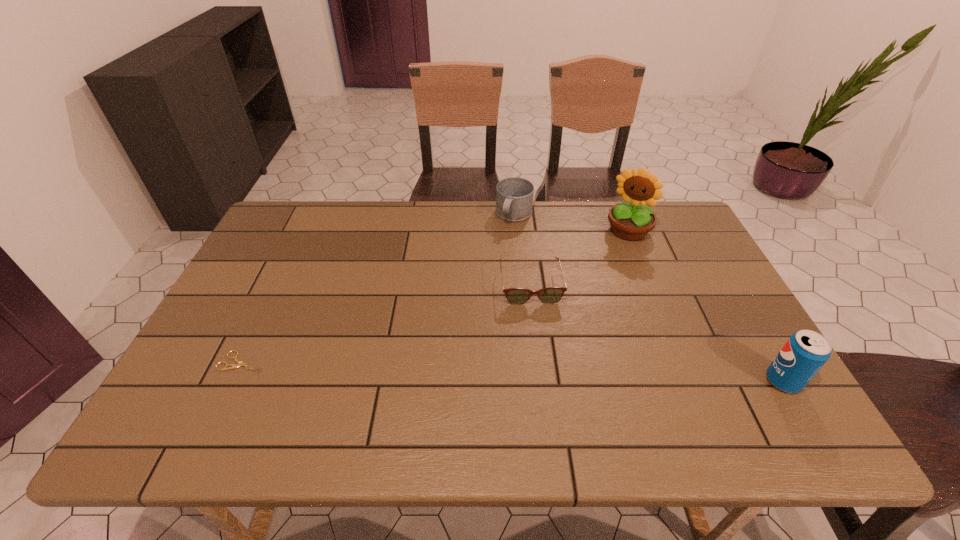
The height and width of the screenshot is (540, 960). Identify the location of vacant region at the far edge of the desktop. click(332, 222).

Locate an element on the screen. blank space at the near edge of the desktop is located at coordinates (486, 382).

Where is `vacant space at the left edge of the desktop`? This screenshot has height=540, width=960. vacant space at the left edge of the desktop is located at coordinates (253, 252).

At what (x,y) coordinates should I click in order to perform the action: click on vacant space at the right edge of the desktop. Please return your answer as a coordinate pair (x, y). Image resolution: width=960 pixels, height=540 pixels. Looking at the image, I should click on (664, 258).

In the image, there is a desktop. Identify the location of free space at the far left corner. The image size is (960, 540). (296, 234).

Locate an element on the screen. free space at the near left corner is located at coordinates (205, 370).

The width and height of the screenshot is (960, 540). Find the location of `vacant space at the far right corner of the desktop`. vacant space at the far right corner of the desktop is located at coordinates (659, 233).

Image resolution: width=960 pixels, height=540 pixels. I want to click on empty space between the tallest object and the shortest object, so click(x=436, y=296).

At what (x,y) coordinates should I click in order to perform the action: click on vacant region between the leftmost object and the second tallest object. Please return your answer as a coordinate pair (x, y). The image size is (960, 540). Looking at the image, I should click on tap(513, 372).

In order to click on empty space that is in between the shortest object and the second shortest object in this screenshot , I will do `click(387, 323)`.